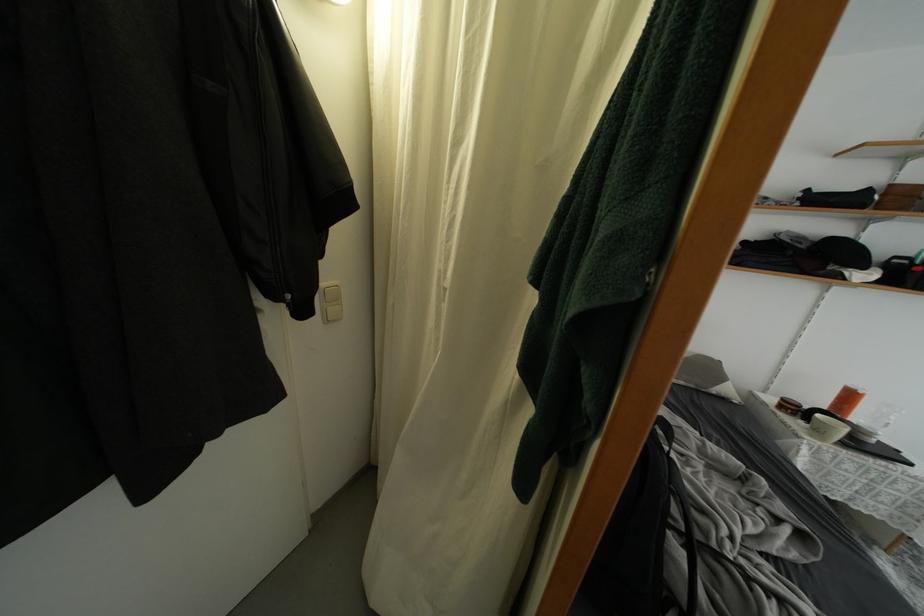
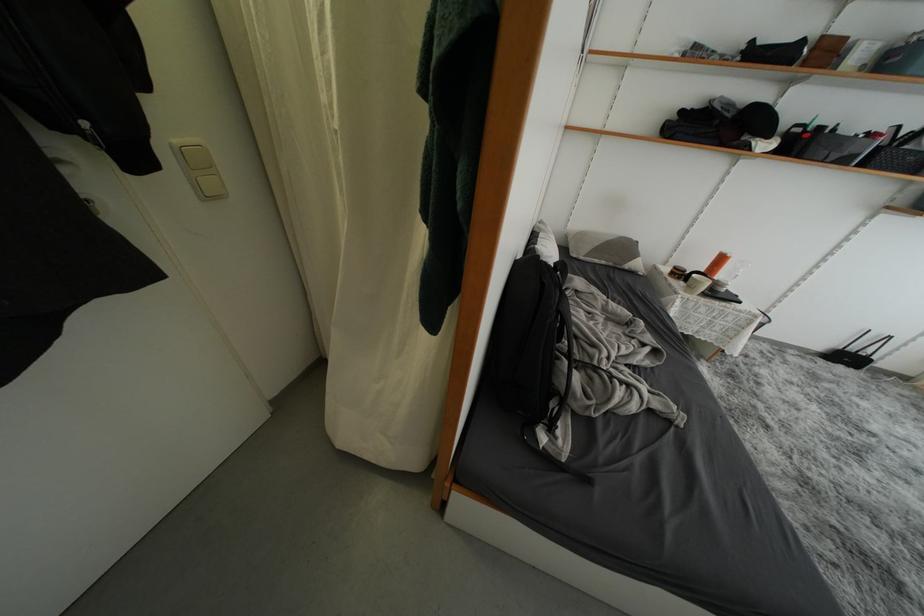
Question: The images are taken continuously from a first-person perspective. In which direction are you moving?

Choices:
 (A) Left
 (B) Right
 (C) Forward
 (D) Backward

Answer: (B)